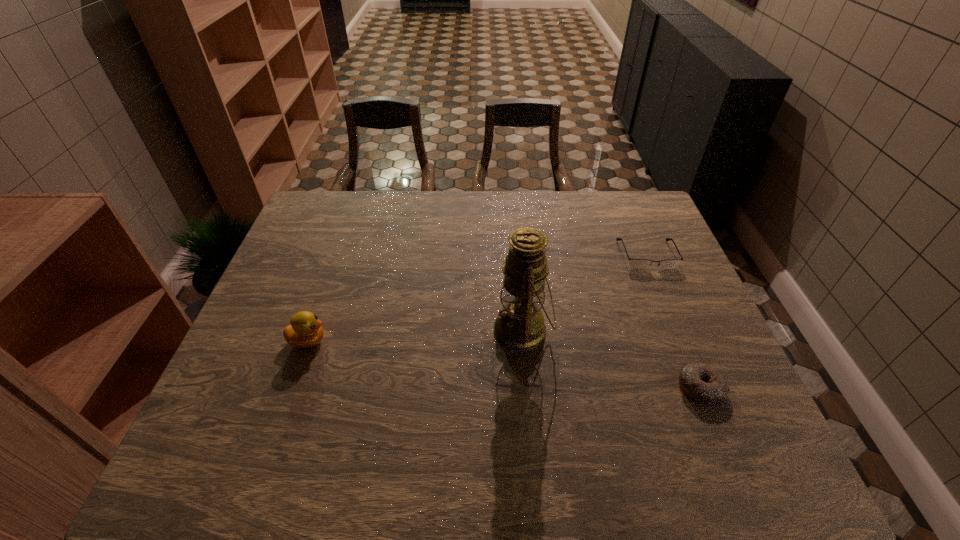
At what (x,y) coordinates should I click in order to perform the action: click on object that is at the left edge. Please return your answer as a coordinate pair (x, y). The image size is (960, 540). Looking at the image, I should click on (305, 331).

Identify the location of doughnut present at the right edge. (703, 383).

I want to click on spectacles that is at the right edge, so click(633, 263).

Find the location of a particular element. vacant region at the near edge of the desktop is located at coordinates (650, 457).

This screenshot has width=960, height=540. I want to click on free space at the left edge of the desktop, so [x=265, y=323].

Locate an element on the screen. vacant space at the right edge is located at coordinates (632, 253).

Locate an element on the screen. The width and height of the screenshot is (960, 540). vacant point at the far left corner is located at coordinates (340, 224).

In the image, there is a desktop. At what (x,y) coordinates should I click in order to perform the action: click on vacant space at the far right corner. Please return your answer as a coordinate pair (x, y). Looking at the image, I should click on (636, 199).

This screenshot has height=540, width=960. What are the coordinates of `vacant area that lies between the duckling and the farthest object` in the screenshot? It's located at (477, 298).

Image resolution: width=960 pixels, height=540 pixels. Identify the location of free area in between the nearest object and the farthest object. (674, 321).